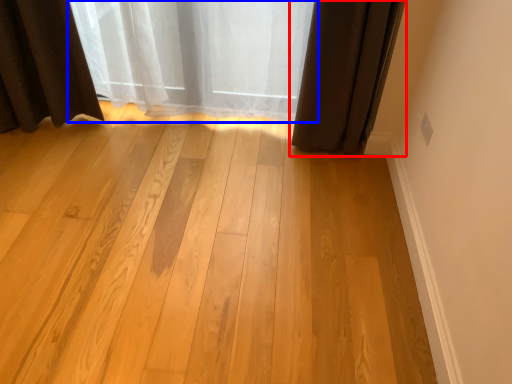
Question: Which point is closer to the camera, curtain (highlighted by a red box) or curtain (highlighted by a blue box)?

Choices:
 (A) curtain
 (B) curtain

Answer: (A)